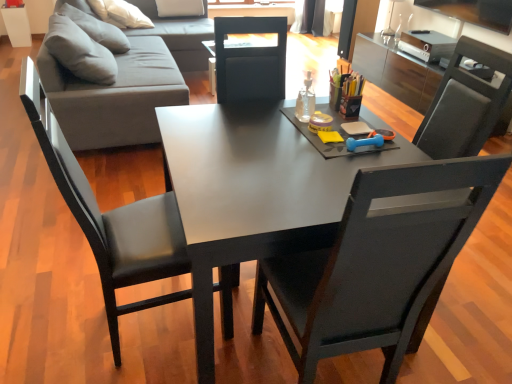
Identify the location of free location to the right of transparent glass bottle at center. (336, 117).